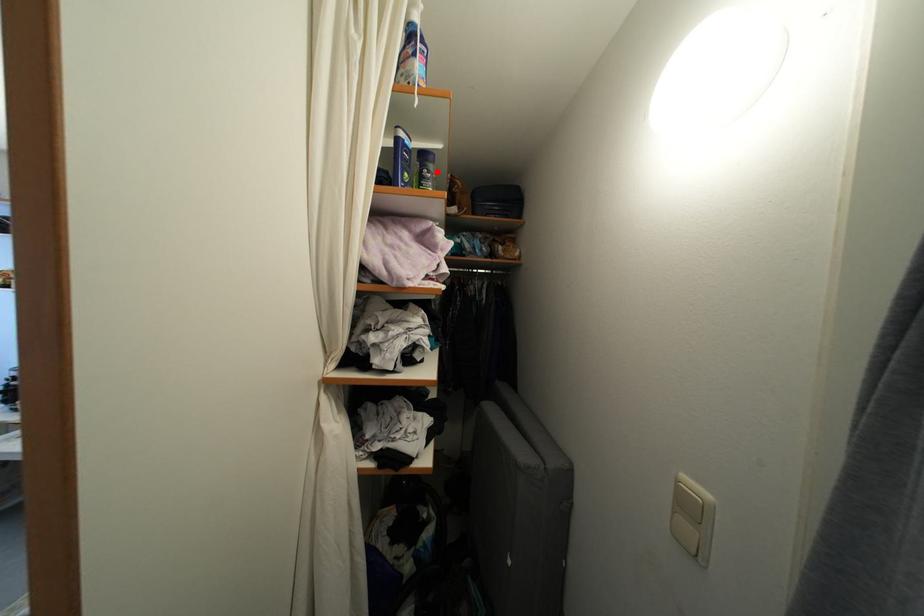
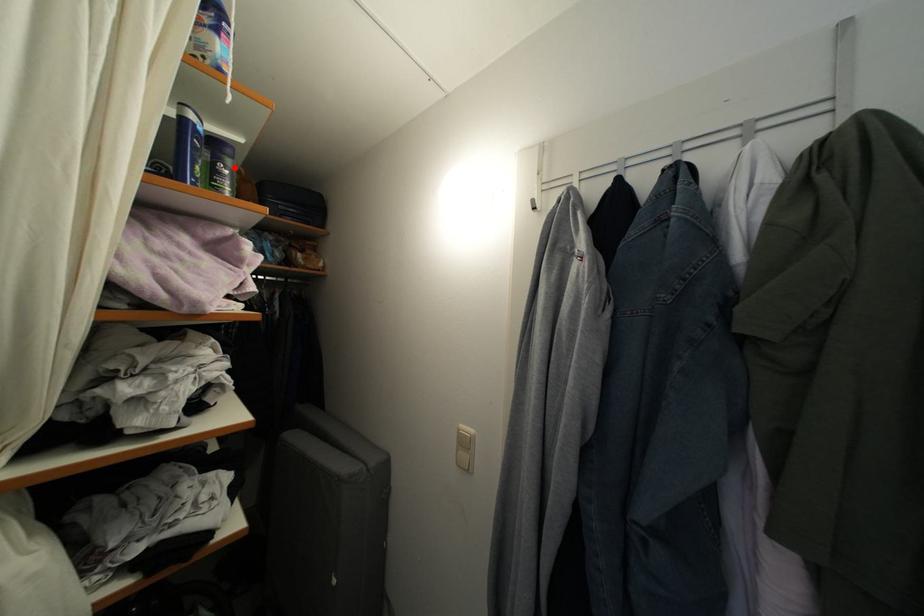
I am providing you with two images of the same scene from different viewpoints. A red point is marked on the first image and another point is marked on the second image. Do the highlighted points in image1 and image2 indicate the same real-world spot?

Yes